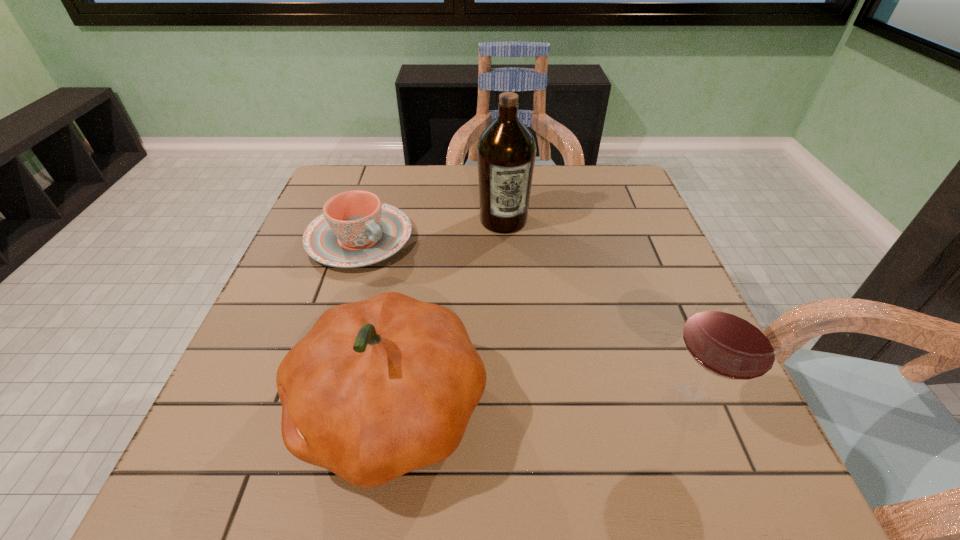
This screenshot has width=960, height=540. I want to click on pumpkin, so click(x=377, y=388).

You are a GUI agent. You are given a task and a screenshot of the screen. Output one action in this format:
    pyautogui.click(x=<x>, y=<y>)
    Task: Click on the rightmost object
    
    Given the screenshot: What is the action you would take?
    pyautogui.click(x=731, y=335)

Identify the location of the shortest object. (356, 229).

Identify the location of olive oil. The height and width of the screenshot is (540, 960). (506, 151).

You are a GUI agent. You are given a task and a screenshot of the screen. Output one action in this format:
    pyautogui.click(x=<x>, y=<y>)
    Task: Click on the vacant point located on the left of the wineglass
    This screenshot has height=540, width=960.
    Given the screenshot: What is the action you would take?
    596,407

I want to click on vacant space positioned on the handle side of the shortest object, so click(x=487, y=340).

Locate an element on the screen. This screenshot has height=540, width=960. free space located on the handle side of the shortest object is located at coordinates (516, 363).

Locate an element on the screen. vacant space situated on the handle side of the shortest object is located at coordinates (438, 301).

You are a GUI agent. You are given a task and a screenshot of the screen. Output one action in this format:
    pyautogui.click(x=<x>, y=<y>)
    Task: Click on the vacant space located 0.100m on the label of the olive oil
    
    Given the screenshot: What is the action you would take?
    pyautogui.click(x=516, y=262)

Where is `free space located 0.230m on the label of the olive oil`? The image size is (960, 540). free space located 0.230m on the label of the olive oil is located at coordinates (528, 301).